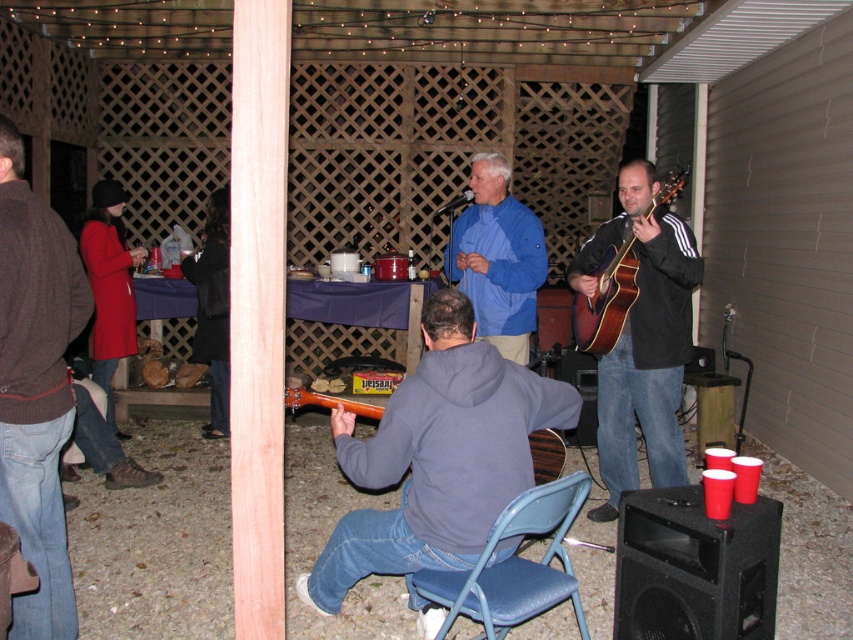
Question: Does acoustic wood guitar at right appear on the right side of wooden acoustic guitar at center?

Choices:
 (A) no
 (B) yes

Answer: (B)

Question: Which point appears farthest from the camera in this image?

Choices:
 (A) (64, 417)
 (B) (581, 480)
 (C) (224, 330)
 (D) (433, 608)

Answer: (C)

Question: Which object appears farthest from the camera in this image?

Choices:
 (A) matte red coat at left
 (B) matte brown guitar at right

Answer: (A)

Question: Is brown sweater at left thinner than matte red coat at left?

Choices:
 (A) no
 (B) yes

Answer: (B)

Question: Which of the following is the farthest from the observer?

Choices:
 (A) (219, 433)
 (B) (618, 278)
 (C) (683, 301)

Answer: (A)

Question: Does brown sweater at left have a smaller size compared to acoustic wood guitar at right?

Choices:
 (A) no
 (B) yes

Answer: (B)